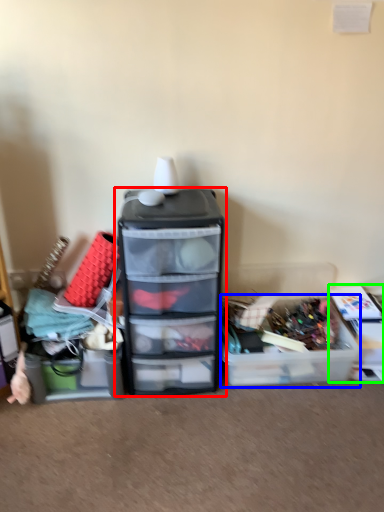
Question: Which is nearer to the furniture (highlighted by a red box)? storage box (highlighted by a blue box) or storage box (highlighted by a green box).

Choices:
 (A) storage box
 (B) storage box

Answer: (A)